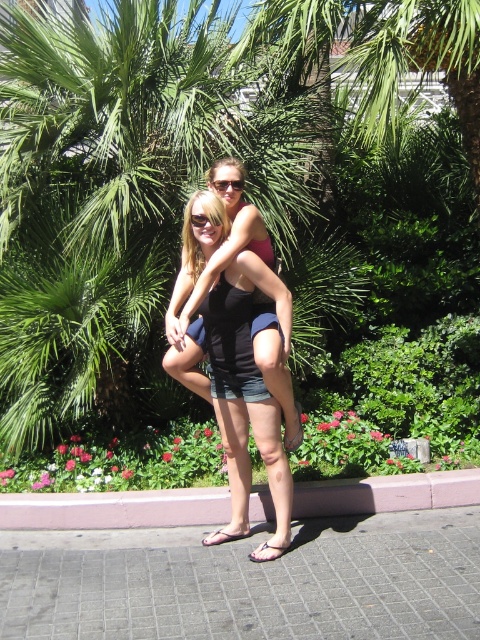
Question: Observing the image, what is the correct spatial positioning of pink concrete curb at lower center in reference to black rubber sandal at lower center?

Choices:
 (A) below
 (B) above

Answer: (B)

Question: Among these points, which one is nearest to the camera?

Choices:
 (A) (220, 184)
 (B) (286, 445)

Answer: (A)

Question: Which object is farther from the camera taking this photo?

Choices:
 (A) pink fabric sandal at lower center
 (B) black plastic sunglasses at center
 (C) pink concrete curb at lower center
 (D) green leafy tree at upper center

Answer: (D)

Question: Which point is farther from the camera taking this photo?

Choices:
 (A) (398, 198)
 (B) (264, 560)

Answer: (A)

Question: Is gray tile pavement at lower center further to the viewer compared to matte black shorts at center?

Choices:
 (A) no
 (B) yes

Answer: (A)

Question: Does green leafy tree at upper center have a smaller size compared to black plastic sunglasses at center?

Choices:
 (A) no
 (B) yes

Answer: (A)